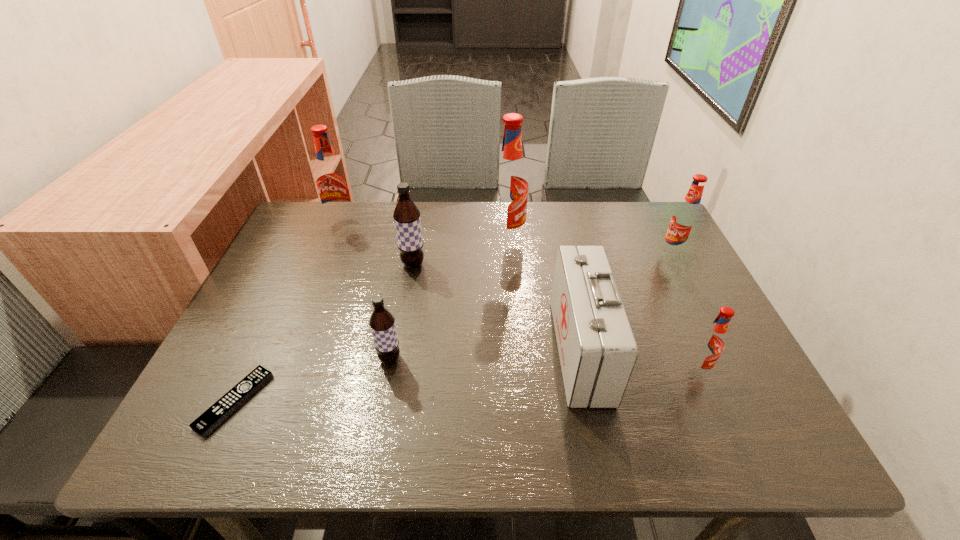
Locate an element on the screen. free space between the shortest object and the third object from right to left is located at coordinates (407, 375).

Find the location of `vacant area that lies between the smaller brown root beer and the red first-aid kit`. vacant area that lies between the smaller brown root beer and the red first-aid kit is located at coordinates (485, 354).

This screenshot has height=540, width=960. I want to click on empty space between the second smallest red root beer and the bigger brown root beer, so click(x=543, y=259).

Locate an element on the screen. The width and height of the screenshot is (960, 540). vacant area that lies between the second object from right to left and the second biggest red root beer is located at coordinates (519, 297).

The width and height of the screenshot is (960, 540). I want to click on free spot between the remote control and the nearest red root beer, so click(x=466, y=386).

Where is `object that ranks as the third closest to the third red root beer from left to right`? object that ranks as the third closest to the third red root beer from left to right is located at coordinates (509, 185).

Select which object is the fourth closest to the rightmost object. Please provide its 2D coordinates. Your answer should be formatted as a tuple, i.e. [(x, y)], where the tuple contains the x and y coordinates of a point satisfying the conditions above.

[(406, 215)]

At what (x,y) coordinates should I click in order to perform the action: click on root beer that can be found as the second closest to the fourth object from right to left. Please return your answer as a coordinate pair (x, y). Looking at the image, I should click on (685, 219).

Locate which root beer ranks in proximity to the bigger brown root beer. Please provide its 2D coordinates. Your answer should be formatted as a tuple, i.e. [(x, y)], where the tuple contains the x and y coordinates of a point satisfying the conditions above.

[(509, 185)]

Choose which red root beer is the fourth nearest neighbor to the nearer brown root beer. Please provide its 2D coordinates. Your answer should be formatted as a tuple, i.e. [(x, y)], where the tuple contains the x and y coordinates of a point satisfying the conditions above.

[(685, 219)]